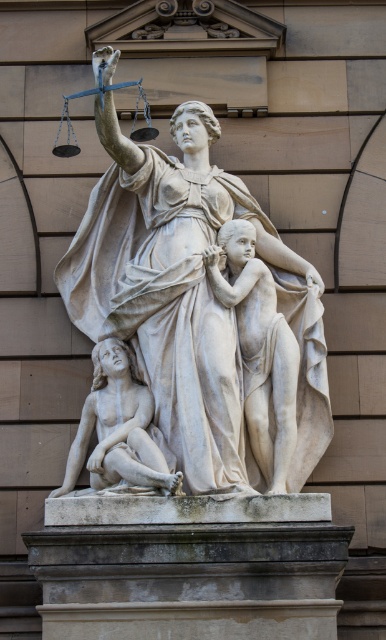
Question: Can you confirm if white marble nude figure at center is positioned to the right of white marble figure at lower left?

Choices:
 (A) no
 (B) yes

Answer: (B)

Question: Does white marble statue at center lie behind white marble nude figure at center?

Choices:
 (A) no
 (B) yes

Answer: (A)

Question: Which point is farther from the camera taking this photo?

Choices:
 (A) (265, 404)
 (B) (287, 349)
 (C) (169, 477)

Answer: (B)

Question: Among these objects, which one is farthest from the camera?

Choices:
 (A) white marble figure at lower left
 (B) white marble statue at center
 (C) white marble nude figure at center

Answer: (A)

Question: From the image, what is the correct spatial relationship of white marble statue at center in relation to white marble figure at lower left?

Choices:
 (A) above
 (B) below

Answer: (A)

Question: Which object appears farthest from the camera in this image?

Choices:
 (A) white marble statue at center
 (B) white marble figure at lower left
 (C) white marble nude figure at center

Answer: (B)